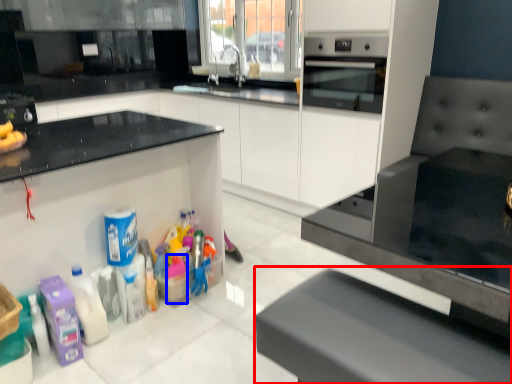
Question: Which object appears farthest to the camera in this image, furniture (highlighted by a red box) or cleaning product (highlighted by a blue box)?

Choices:
 (A) furniture
 (B) cleaning product

Answer: (B)